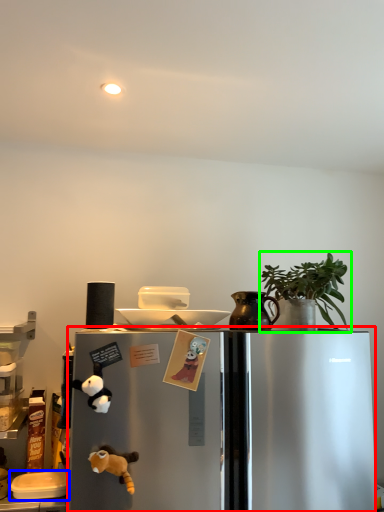
Question: Considering the real-world distances, which object is closest to refrigerator (highlighted by a red box)? appliance (highlighted by a blue box) or houseplant (highlighted by a green box).

Choices:
 (A) appliance
 (B) houseplant

Answer: (B)